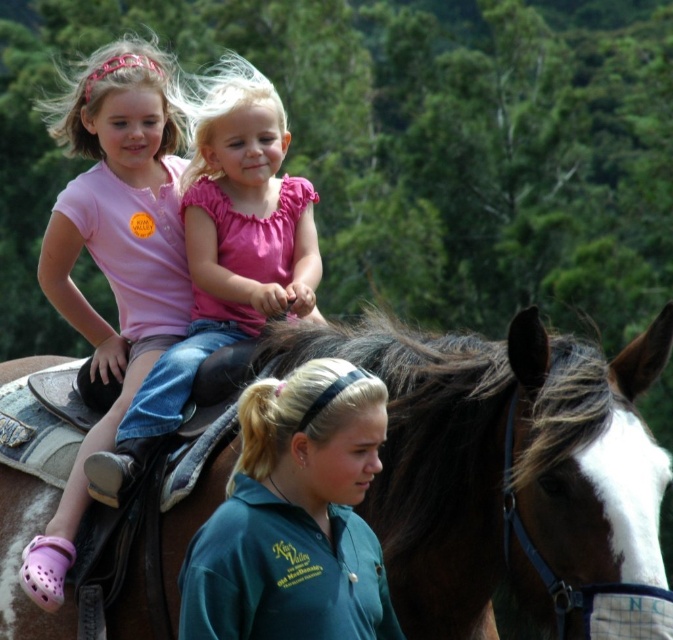
Is point (250, 573) behind point (256, 128)?

No, (250, 573) is in front of (256, 128).

Between point (384, 596) and point (116, 449), which one is positioned behind?

Point (116, 449)

Is point (297, 624) positioned in front of point (244, 112)?

Yes, it is in front of point (244, 112).

At what (x,y) coordinates should I click in order to perform the action: click on green fabric shirt at center. Please return your answer as a coordinate pair (x, y). Image resolution: width=673 pixels, height=640 pixels. Looking at the image, I should click on (295, 516).

Is brown glossy horse at upper center above pink cotton shirt at upper center?

Actually, brown glossy horse at upper center is below pink cotton shirt at upper center.

Is brown glossy horse at upper center behind pink cotton shirt at upper center?

No, it is not.

Does point (423, 372) come farther from viewer compared to point (279, 193)?

No, it is not.

The height and width of the screenshot is (640, 673). In order to click on brown glossy horse at upper center in this screenshot , I will do `click(501, 460)`.

Does pink matte shirt at upper left have a lesser height compared to pink cotton shirt at upper center?

In fact, pink matte shirt at upper left may be taller than pink cotton shirt at upper center.

Describe the element at coordinates (112, 257) in the screenshot. I see `pink matte shirt at upper left` at that location.

The width and height of the screenshot is (673, 640). I want to click on pink matte shirt at upper left, so click(x=112, y=257).